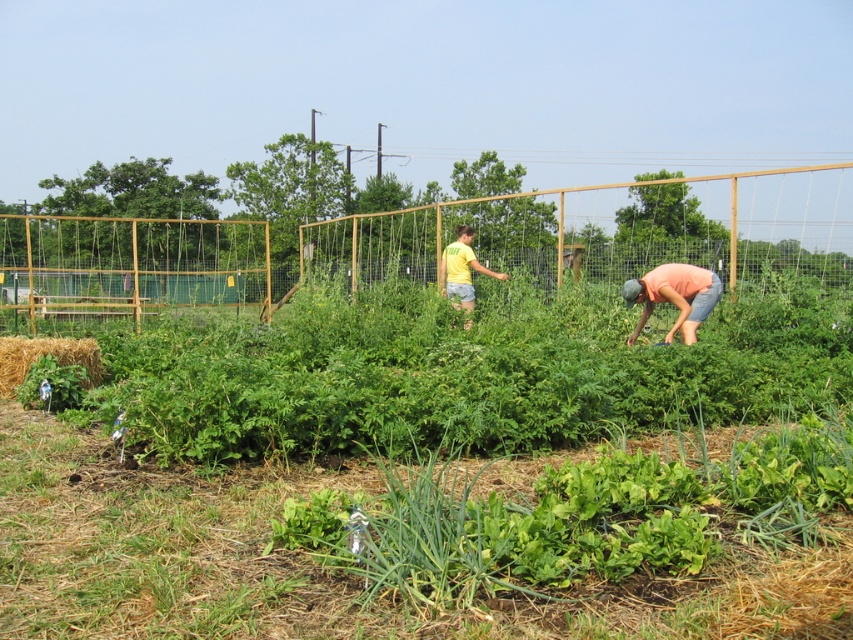
Question: Which object appears closest to the camera in this image?

Choices:
 (A) yellow cotton shirt at center
 (B) pink cotton shirt at right

Answer: (B)

Question: Is pink cotton shirt at right above yellow cotton shirt at center?

Choices:
 (A) no
 (B) yes

Answer: (A)

Question: Is pink cotton shirt at right in front of brown straw bale at lower left?

Choices:
 (A) no
 (B) yes

Answer: (A)

Question: Which point appears farthest from the camera in this image?

Choices:
 (A) (463, 276)
 (B) (680, 268)
 (C) (57, 346)

Answer: (A)

Question: Does pink cotton shirt at right have a greater width compared to brown straw bale at lower left?

Choices:
 (A) no
 (B) yes

Answer: (A)

Question: Which object is the farthest from the yellow cotton shirt at center?

Choices:
 (A) brown straw bale at lower left
 (B) pink cotton shirt at right

Answer: (A)